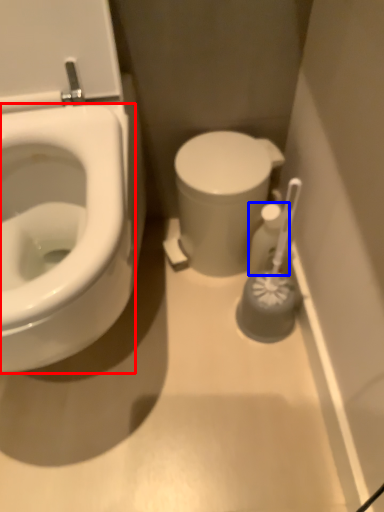
Question: Which object is closer to the camera taking this photo, bidet (highlighted by a red box) or toiletry (highlighted by a blue box)?

Choices:
 (A) bidet
 (B) toiletry

Answer: (A)